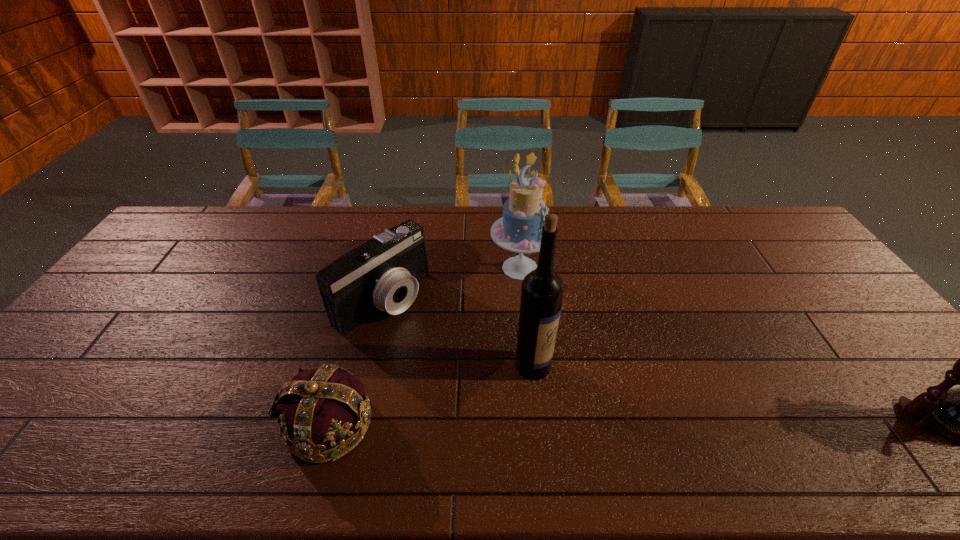
At what (x,y) coordinates should I click in order to perform the action: click on vacant space in between the fourth shortest object and the camcorder. Please return your answer as a coordinate pair (x, y). The height and width of the screenshot is (540, 960). Looking at the image, I should click on (451, 284).

Locate an element on the screen. Image resolution: width=960 pixels, height=540 pixels. vacant region between the camcorder and the shortest object is located at coordinates (355, 361).

In order to click on free spot between the cake and the second shortest object in this screenshot , I will do `click(451, 284)`.

Select which object appears as the third closest to the second tallest object. Please provide its 2D coordinates. Your answer should be formatted as a tuple, i.e. [(x, y)], where the tuple contains the x and y coordinates of a point satisfying the conditions above.

[(325, 412)]

You are a GUI agent. You are given a task and a screenshot of the screen. Output one action in this format:
    pyautogui.click(x=<x>, y=<y>)
    Task: Click on the object that is the third closest to the camcorder
    Image resolution: width=960 pixels, height=540 pixels.
    Given the screenshot: What is the action you would take?
    pyautogui.click(x=542, y=289)

This screenshot has height=540, width=960. In order to click on free location that satisfies the following two spatial constraints: 1. on the back side of the camcorder; 2. on the right side of the second tallest object in this screenshot , I will do `click(390, 268)`.